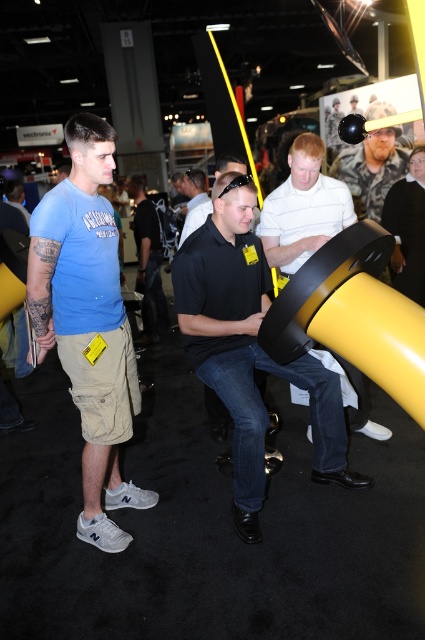
Question: In this image, where is blue cotton t-shirt at left located relative to black matte shirt at center?

Choices:
 (A) above
 (B) below

Answer: (B)

Question: Which of the following is the farthest from the observer?

Choices:
 (A) camouflage shirt at upper right
 (B) black matte shirt at center
 (C) black matte steering wheel at center
 (D) white matte shirt at center

Answer: (B)

Question: Which of the following is the closest to the observer?

Choices:
 (A) (167, 314)
 (B) (85, 124)
 (C) (265, 244)
 (D) (397, 189)

Answer: (B)

Question: Among these points, which one is farthest from the camera?

Choices:
 (A) (176, 296)
 (B) (396, 257)
 (C) (139, 259)
 (D) (320, 204)

Answer: (C)

Question: Is white matte shirt at center positioned before black matte shirt at center?

Choices:
 (A) yes
 (B) no

Answer: (A)

Question: Can you confirm if blue cotton t-shirt at left is positioned to the right of black matte steering wheel at center?

Choices:
 (A) yes
 (B) no

Answer: (B)